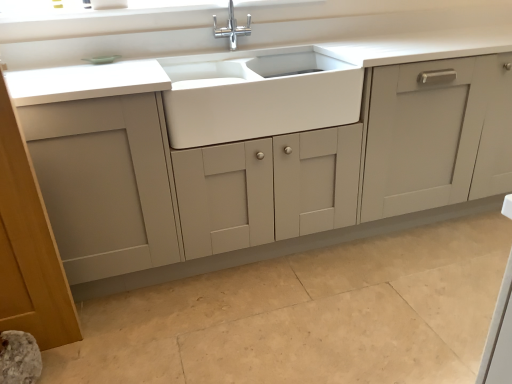
Question: Should I look upward or downward to see white ceramic sink at center?

Choices:
 (A) up
 (B) down

Answer: (A)